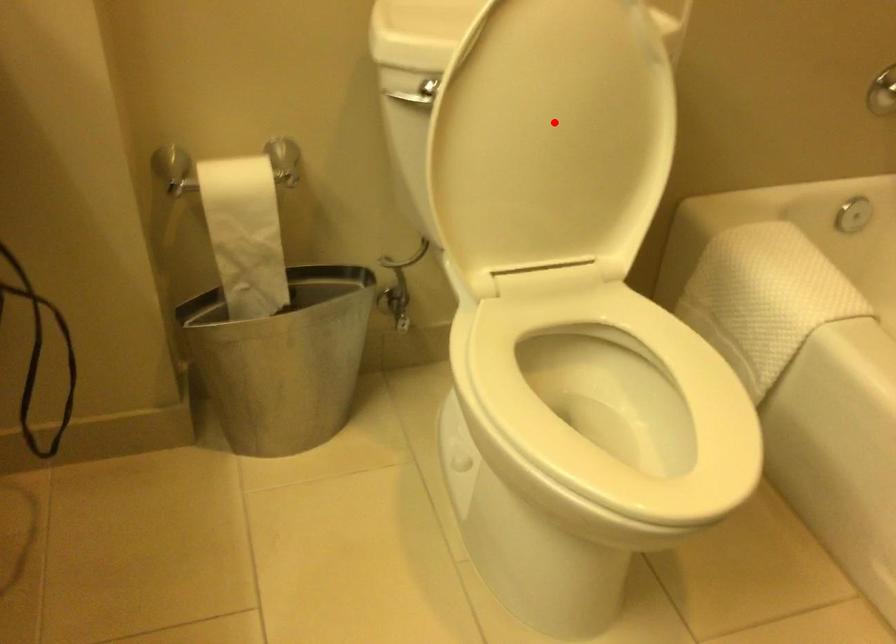
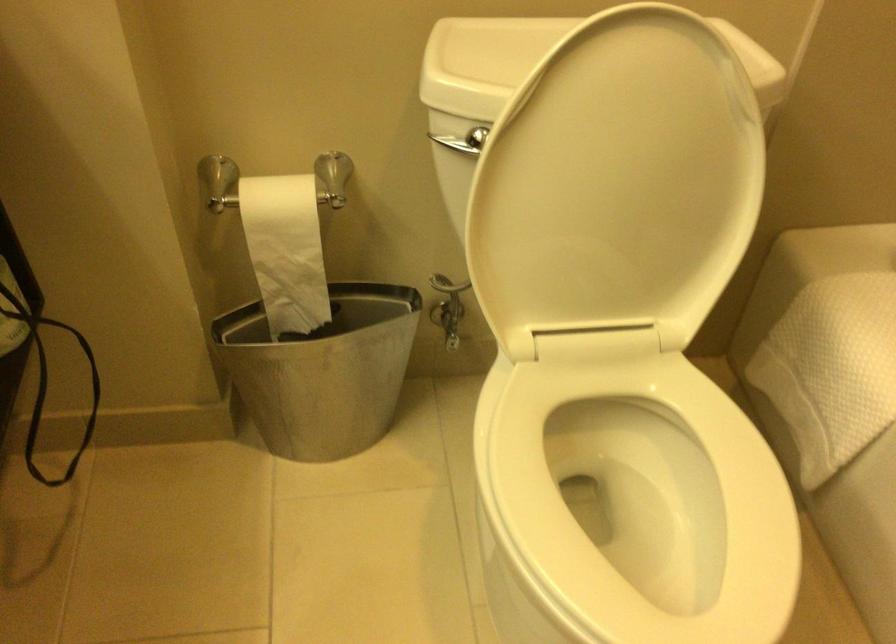
Question: I am providing you with two images of the same scene from different viewpoints. A red point is shown in image1. For the corresponding object point in image2, is it positioned nearer or farther from the camera?

Choices:
 (A) Nearer
 (B) Farther

Answer: (A)